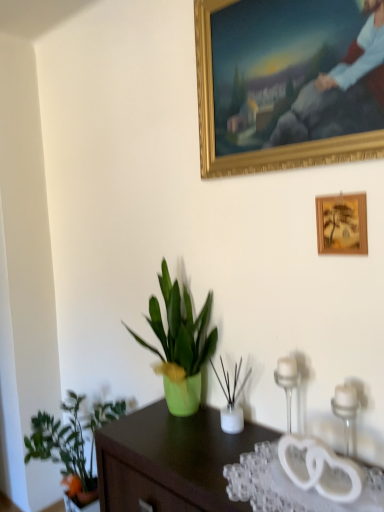
Find the location of a particular element. The height and width of the screenshot is (512, 384). free region on the left part of clear glass candle holder at right, marked as the 2th candle holder in a right-to-left arrangement is located at coordinates (253, 455).